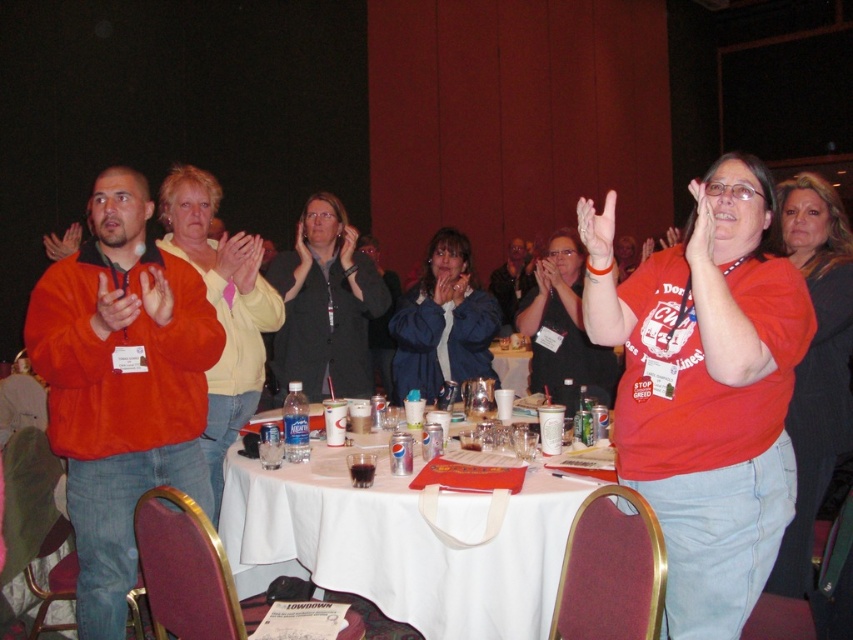
Can you confirm if orange fleece jacket at left is thinner than matte black jacket at center?

Yes, orange fleece jacket at left is thinner than matte black jacket at center.

Who is lower down, orange fleece jacket at left or matte black jacket at center?

orange fleece jacket at left is below.

Who is more forward, (85,417) or (355,298)?

Point (85,417) is more forward.

This screenshot has width=853, height=640. In order to click on orange fleece jacket at left in this screenshot , I will do `click(120, 385)`.

Does point (120, 282) come closer to viewer compared to point (519, 378)?

Yes, it is.

Between point (91, 236) and point (498, 349), which one is positioned behind?

The point (498, 349) is behind.

Is point (166, 314) farther from viewer compared to point (496, 368)?

No, it is not.

What are the coordinates of `orange fleece jacket at left` in the screenshot? It's located at (120, 385).

Is matte black jacket at center further to the viewer compared to white paper cup at center?

No, it is not.

Is matte black jacket at center bigger than white paper cup at center?

Yes.

Identify the location of matte black jacket at center. The width and height of the screenshot is (853, 640). (325, 305).